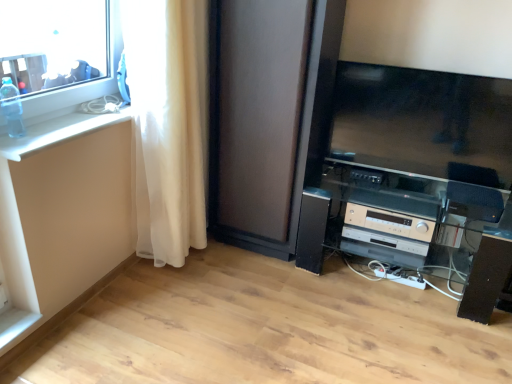
Identify the location of free space below satin black entertainment center at lower right (from a real-world perspective). This screenshot has height=384, width=512. (387, 285).